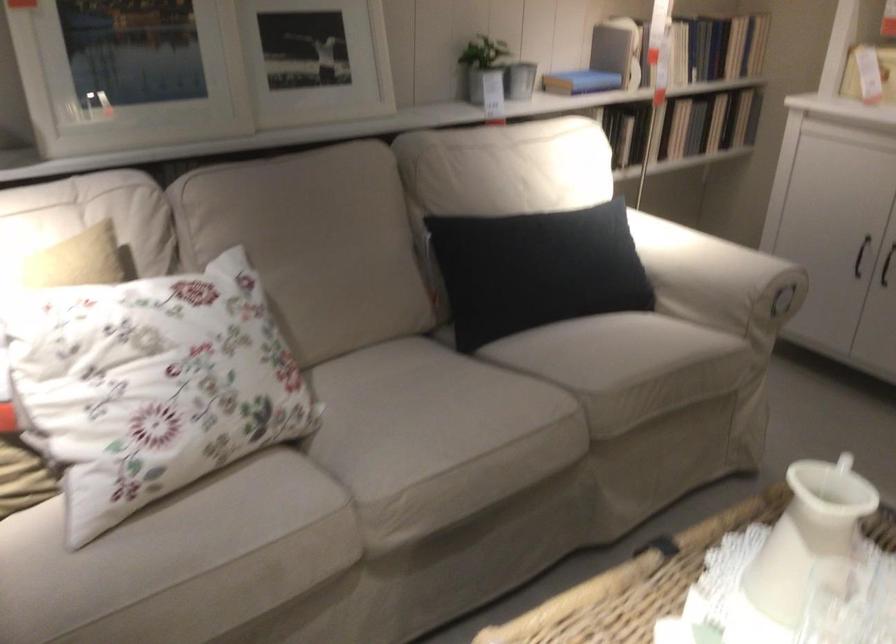
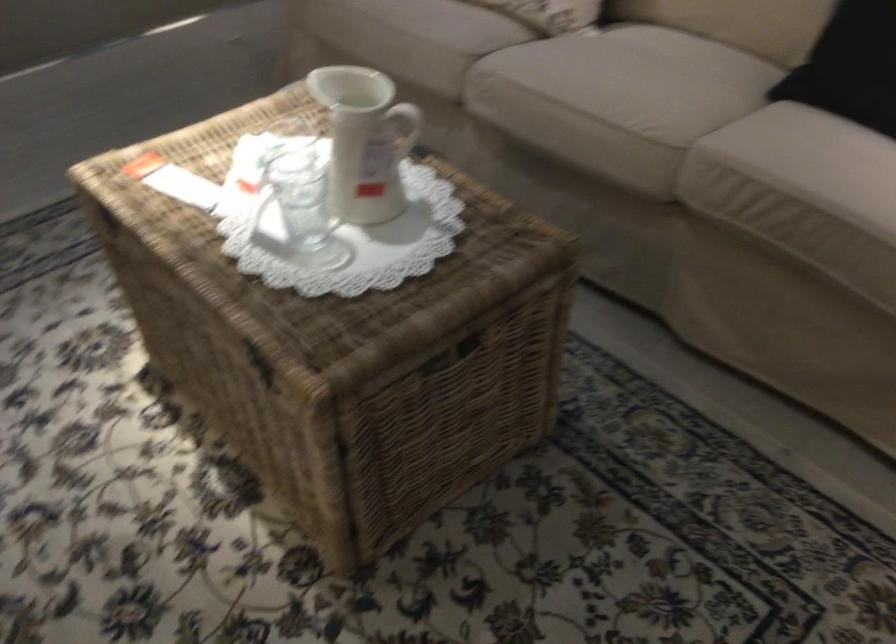
Find the pixel in the second image that matches (x=479, y=422) in the first image.

(617, 93)